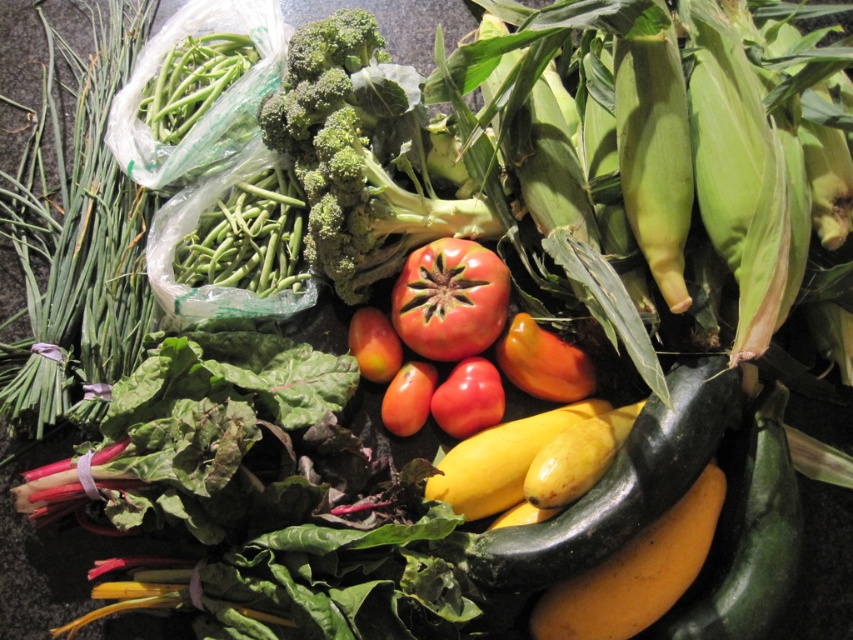
You are a drone operator trying to deliver a package to a specific point in the image. You have two delivery points marked as point 1 at coordinates point (479, 394) and point 2 at coordinates point (398, 380). Which point is closer to the observer?

Point (479, 394) is in front of point (398, 380), so it is closer to the observer.

You are arranging vegetables on a table and see both the red matte tomato at center and the glossy red tomato at center. If you want to place a new vegetable between them, where should you position it?

You should position the new vegetable between the red matte tomato at center and the glossy red tomato at center, as the red matte tomato at center is to the right of the glossy red tomato at center.

You are a photographer trying to capture a detailed shot of the vegetables. You notice two points marked in the image. Which point, point (550, 612) or point (514, 452), is closer to your camera lens?

Point (550, 612) is closer to the camera lens than point (514, 452).